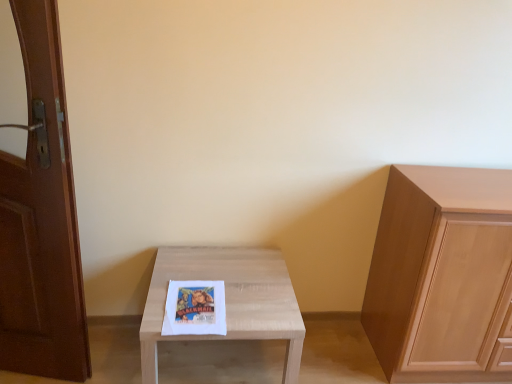
Question: Is light wood table at center positioned far away from brown wooden door at left?

Choices:
 (A) no
 (B) yes

Answer: (A)

Question: Is light wood table at center not inside brown wooden door at left?

Choices:
 (A) no
 (B) yes

Answer: (B)

Question: Considering the relative sizes of light wood table at center and brown wooden door at left in the image provided, is light wood table at center wider than brown wooden door at left?

Choices:
 (A) no
 (B) yes

Answer: (B)

Question: From a real-world perspective, is light wood table at center positioned over brown wooden door at left based on gravity?

Choices:
 (A) yes
 (B) no

Answer: (B)

Question: Considering the relative sizes of light wood table at center and brown wooden door at left in the image provided, is light wood table at center taller than brown wooden door at left?

Choices:
 (A) yes
 (B) no

Answer: (B)

Question: Is the position of light wood table at center less distant than that of brown wooden door at left?

Choices:
 (A) yes
 (B) no

Answer: (B)

Question: From a real-world perspective, is light wood cabinet at right over brown wooden door at left?

Choices:
 (A) no
 (B) yes

Answer: (A)

Question: Is light wood cabinet at right turned away from brown wooden door at left?

Choices:
 (A) yes
 (B) no

Answer: (B)

Question: Does light wood cabinet at right appear on the right side of brown wooden door at left?

Choices:
 (A) no
 (B) yes

Answer: (B)

Question: Is light wood cabinet at right far from brown wooden door at left?

Choices:
 (A) yes
 (B) no

Answer: (A)

Question: Considering the relative sizes of light wood cabinet at right and brown wooden door at left in the image provided, is light wood cabinet at right shorter than brown wooden door at left?

Choices:
 (A) yes
 (B) no

Answer: (A)

Question: From the image's perspective, does light wood cabinet at right appear higher than brown wooden door at left?

Choices:
 (A) no
 (B) yes

Answer: (A)

Question: Is brown wooden door at left at the left side of light wood cabinet at right?

Choices:
 (A) no
 (B) yes

Answer: (B)